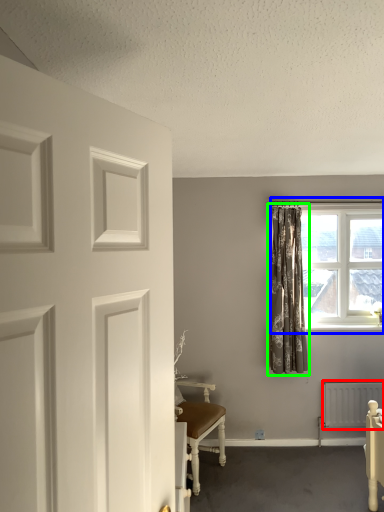
Question: Based on their relative distances, which object is farther from radiator (highlighted by a red box)? Choose from window (highlighted by a blue box) and curtain (highlighted by a green box).

Choices:
 (A) window
 (B) curtain

Answer: (A)